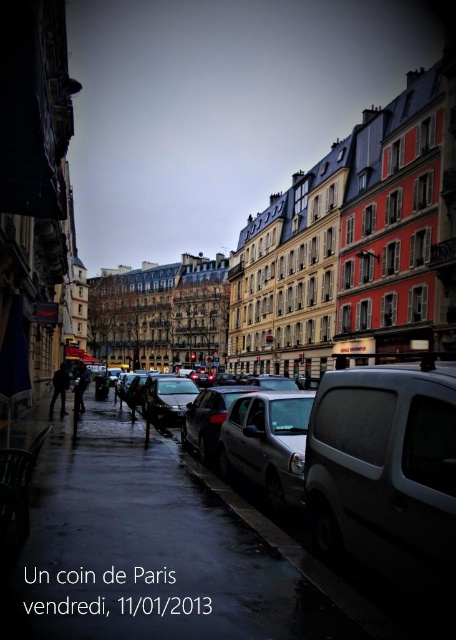
Is point (197, 620) in front of point (65, 385)?

Yes, point (197, 620) is in front of point (65, 385).

Measure the distance between wet asphalt sidewalk at lower left and camera.

32.12 meters

Locate an element on the screen. The image size is (456, 640). wet asphalt sidewalk at lower left is located at coordinates (145, 552).

In the scene shown: Which is more to the right, shiny silver car at center or dark gray jacket at left?

Positioned to the right is shiny silver car at center.

Is shiny silver car at center closer to camera compared to dark gray jacket at left?

Yes, it is in front of dark gray jacket at left.

Measure the distance between point (224, 410) and camera.

Point (224, 410) is 206.73 feet from camera.

Image resolution: width=456 pixels, height=640 pixels. Identify the location of shiny silver car at center. (208, 419).

Is wet asphalt sidewalk at lower left taller than satin black car at center?

No, wet asphalt sidewalk at lower left is not taller than satin black car at center.

Does wet asphalt sidewalk at lower left have a smaller size compared to satin black car at center?

No, wet asphalt sidewalk at lower left is not smaller than satin black car at center.

Describe the element at coordinates (145, 552) in the screenshot. I see `wet asphalt sidewalk at lower left` at that location.

The width and height of the screenshot is (456, 640). Find the location of `wet asphalt sidewalk at lower left`. wet asphalt sidewalk at lower left is located at coordinates (145, 552).